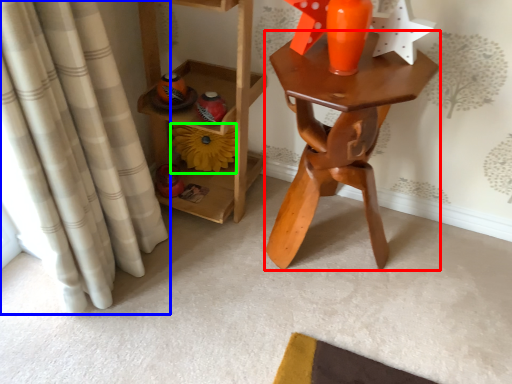
Question: Considering the real-world distances, which object is closest to table (highlighted by a red box)? curtain (highlighted by a blue box) or flower (highlighted by a green box).

Choices:
 (A) curtain
 (B) flower

Answer: (B)